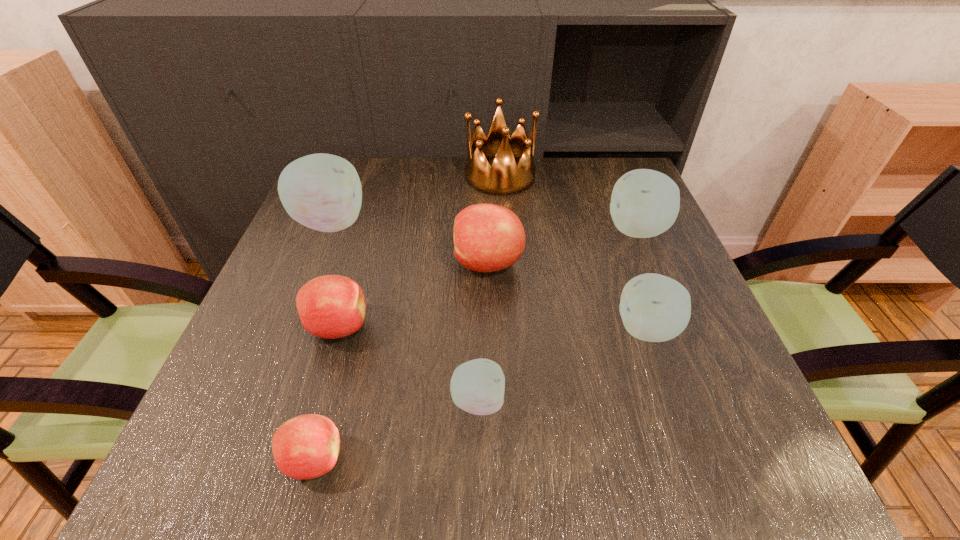
Locate an element on the screen. The height and width of the screenshot is (540, 960). free space at the far right corner of the desktop is located at coordinates (614, 165).

Find the location of a particular element. vacant space at the near right corner of the desktop is located at coordinates pyautogui.click(x=718, y=436).

Find the location of a particular element. This screenshot has width=960, height=540. free point between the tallest apple and the nearest white apple is located at coordinates (404, 312).

Where is `vacant space that's between the rightmost red apple and the second nearest apple`? This screenshot has height=540, width=960. vacant space that's between the rightmost red apple and the second nearest apple is located at coordinates (483, 332).

I want to click on free space between the nearest red apple and the third smallest white apple, so [x=475, y=345].

The height and width of the screenshot is (540, 960). In order to click on vacant space that is in between the second farthest red apple and the farthest red apple in this screenshot , I will do `click(413, 295)`.

You are a GUI agent. You are given a task and a screenshot of the screen. Output one action in this format:
    pyautogui.click(x=<x>, y=<y>)
    Task: Click on the free spot between the biggest red apple and the second farthest red apple
    
    Given the screenshot: What is the action you would take?
    pyautogui.click(x=413, y=295)

I want to click on free space between the farthest red apple and the tallest apple, so click(409, 243).

This screenshot has width=960, height=540. I want to click on free space that is in between the leftmost white apple and the farthest object, so click(416, 200).

Locate an element on the screen. This screenshot has width=960, height=540. free spot between the nearest object and the third smallest white apple is located at coordinates (475, 345).